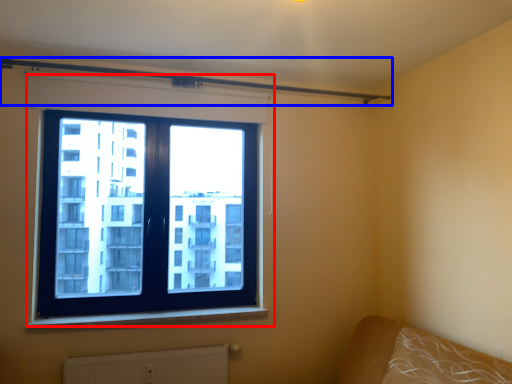
Question: Which point is further to the camera, window (highlighted by a red box) or beam (highlighted by a blue box)?

Choices:
 (A) window
 (B) beam

Answer: (A)